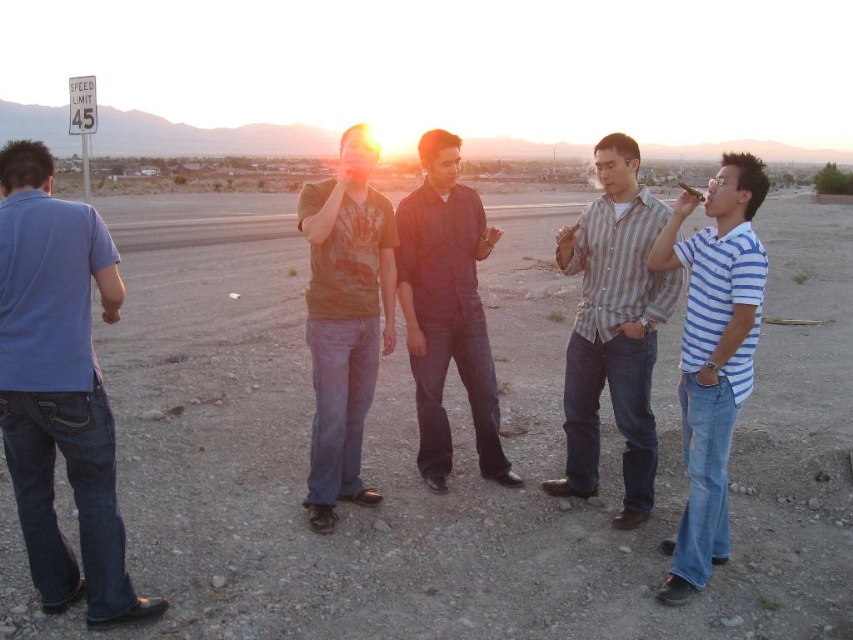
Does blue cotton shirt at left have a greater width compared to dark blue shirt at center?

Correct, the width of blue cotton shirt at left exceeds that of dark blue shirt at center.

Which is behind, point (74, 212) or point (444, 204)?

The point (444, 204) is behind.

Describe the element at coordinates (59, 387) in the screenshot. The image size is (853, 640). I see `blue cotton shirt at left` at that location.

Find the location of a particular element. Image resolution: width=853 pixels, height=640 pixels. blue cotton shirt at left is located at coordinates (59, 387).

Is blue cotton shirt at left bigger than striped cotton shirt at center?

Correct, blue cotton shirt at left is larger in size than striped cotton shirt at center.

You are a GUI agent. You are given a task and a screenshot of the screen. Output one action in this format:
    pyautogui.click(x=<x>, y=<y>)
    Task: Click on the blue cotton shirt at left
    The width and height of the screenshot is (853, 640).
    Given the screenshot: What is the action you would take?
    pyautogui.click(x=59, y=387)

How far apart are striped cotton shirt at center and dark blue shirt at center?

striped cotton shirt at center is 31.19 inches from dark blue shirt at center.

Does point (614, 515) come closer to viewer compared to point (459, 241)?

Yes, it is.

Who is more forward, (618, 284) or (434, 184)?

Point (618, 284) is in front.

This screenshot has height=640, width=853. I want to click on striped cotton shirt at center, so coord(613,328).